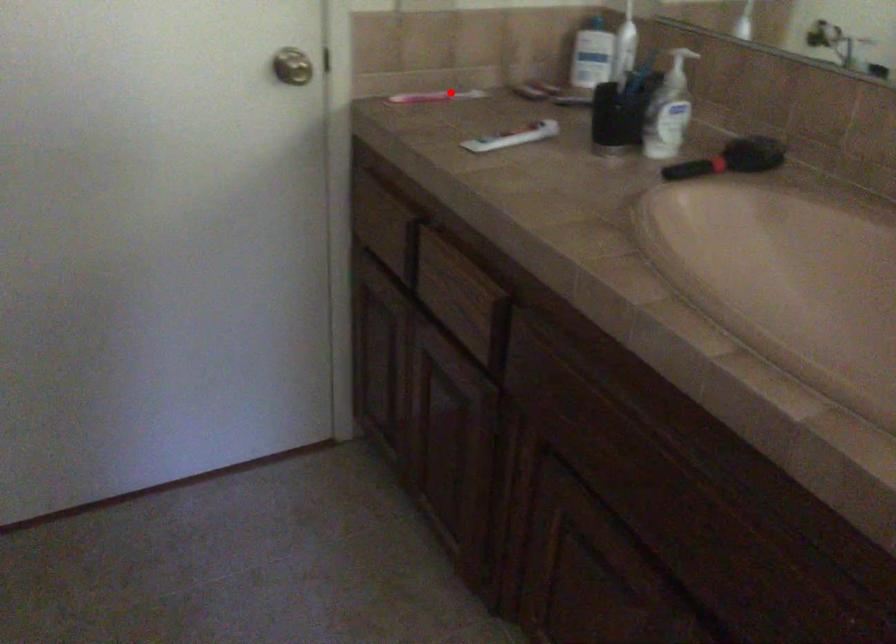
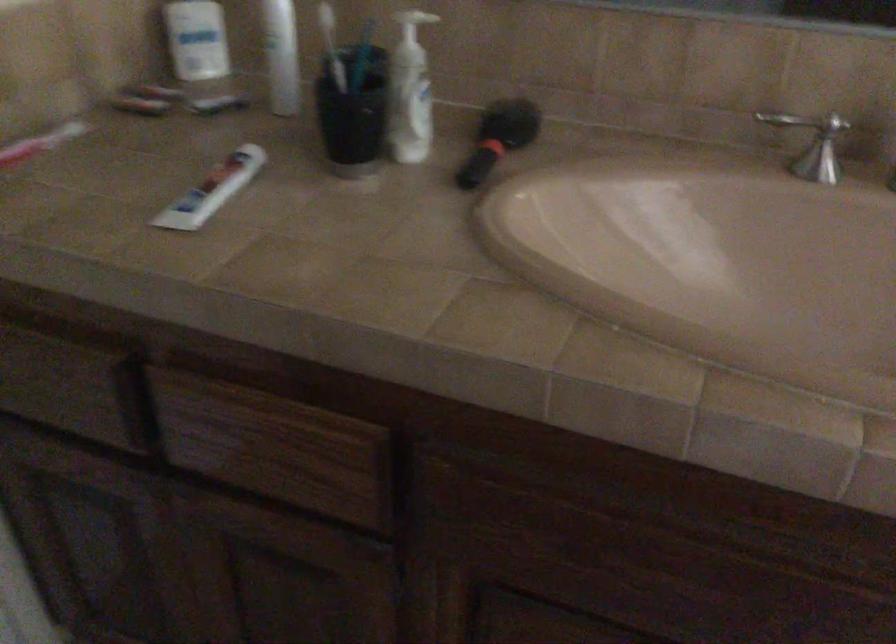
Question: I am providing you with two images of the same scene from different viewpoints. A red point is shown in image1. For the corresponding object point in image2, is it positioned nearer or farther from the camera?

Choices:
 (A) Nearer
 (B) Farther

Answer: (A)